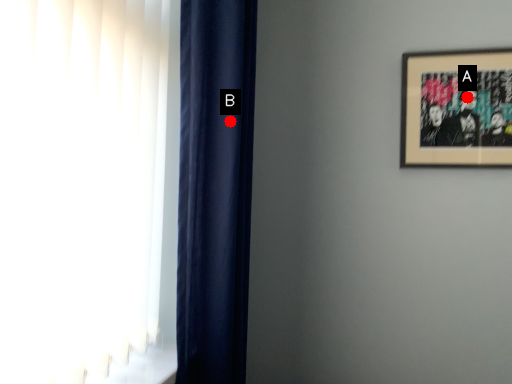
Question: Two points are circled on the image, labeled by A and B beside each circle. Among these points, which one is nearest to the camera?

Choices:
 (A) A is closer
 (B) B is closer

Answer: (B)